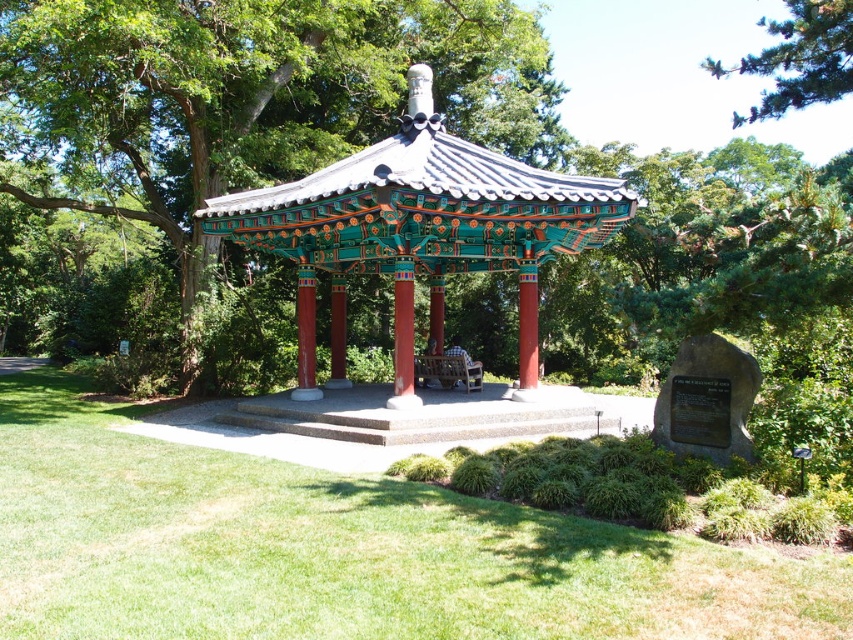
Question: Does green grass at center appear under multicolored painted gazebo at center?

Choices:
 (A) yes
 (B) no

Answer: (A)

Question: Based on their relative distances, which object is farther from the multicolored painted gazebo at center?

Choices:
 (A) green grass at center
 (B) wooden bench at center
 (C) green pine tree at upper right

Answer: (C)

Question: Is green grass at center smaller than green pine tree at upper right?

Choices:
 (A) no
 (B) yes

Answer: (B)

Question: Which point is farther to the camera?

Choices:
 (A) green pine tree at upper right
 (B) multicolored painted gazebo at center

Answer: (B)

Question: Is green pine tree at upper right positioned at the back of wooden bench at center?

Choices:
 (A) yes
 (B) no

Answer: (B)

Question: Which of the following is the closest to the observer?

Choices:
 (A) (343, 317)
 (B) (706, 58)
 (C) (277, 592)
 (D) (457, 381)

Answer: (C)